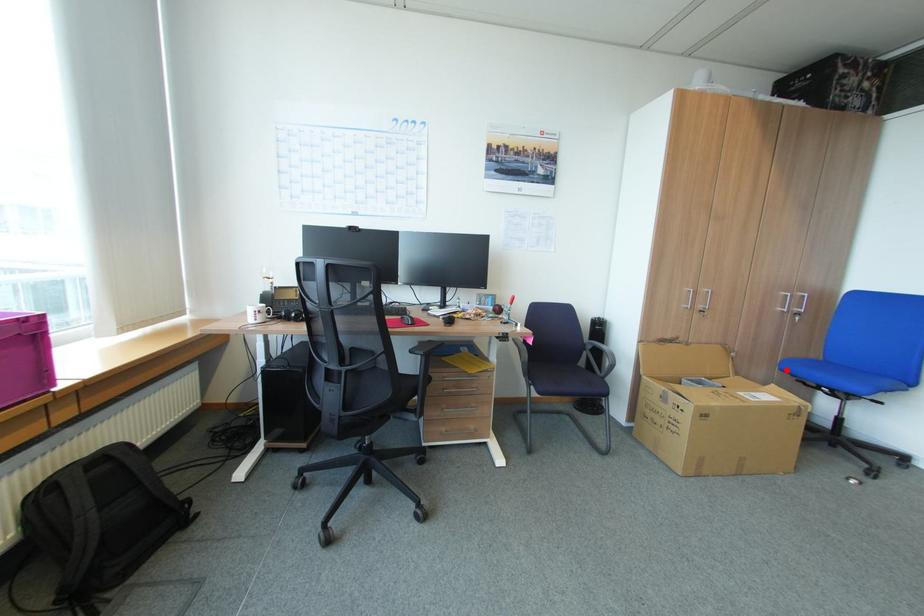
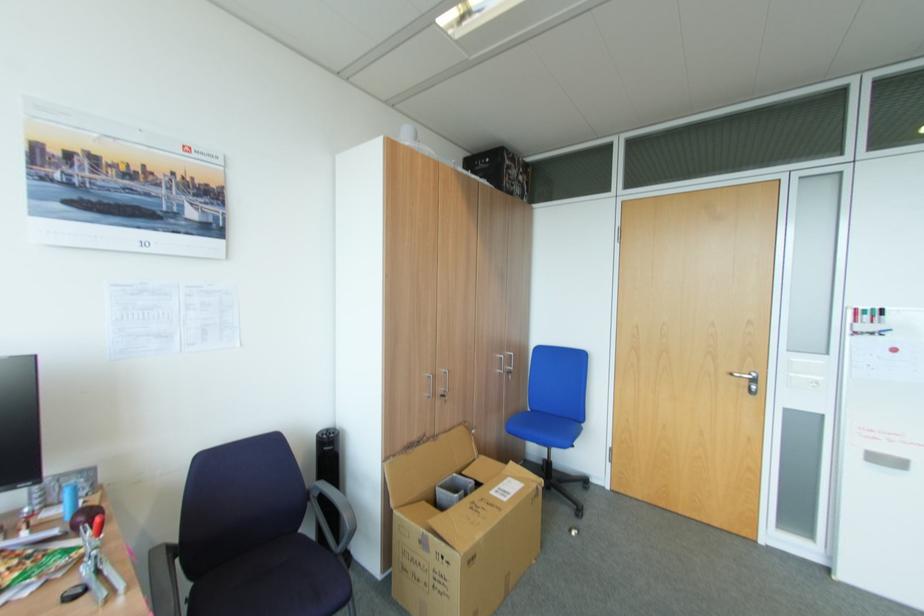
Where in the second image is the point corresponding to the highlighted location from the first image?

(515, 431)